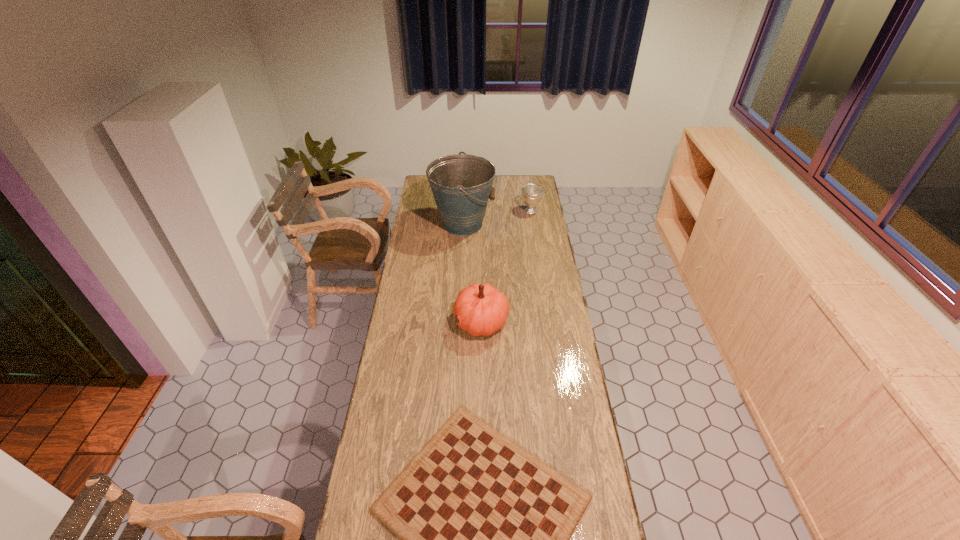
Locate an element on the screen. This screenshot has width=960, height=540. free spot between the chalice and the pumpkin is located at coordinates (506, 266).

Locate which object is the third closest to the third shortest object. Please provide its 2D coordinates. Your answer should be formatted as a tuple, i.e. [(x, y)], where the tuple contains the x and y coordinates of a point satisfying the conditions above.

[(531, 193)]

What are the coordinates of `object that is the second nearest to the chalice` in the screenshot? It's located at (481, 309).

Where is `vacant area in the image that satisfies the following two spatial constraints: 1. on the front side of the second shortest object; 2. on the front-facing side of the third farthest object`? vacant area in the image that satisfies the following two spatial constraints: 1. on the front side of the second shortest object; 2. on the front-facing side of the third farthest object is located at coordinates (547, 321).